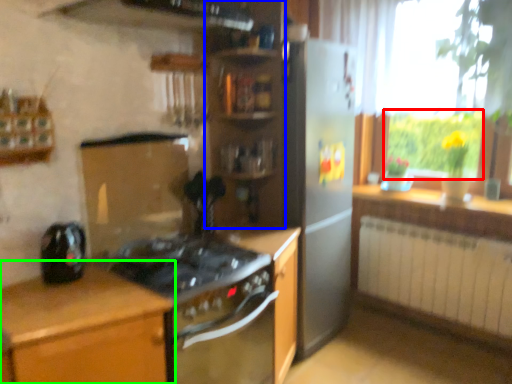
Question: Based on their relative distances, which object is nearer to bright (highlighted by a red box)? Choose from shelf (highlighted by a blue box) and cabinetry (highlighted by a green box).

Choices:
 (A) shelf
 (B) cabinetry

Answer: (A)